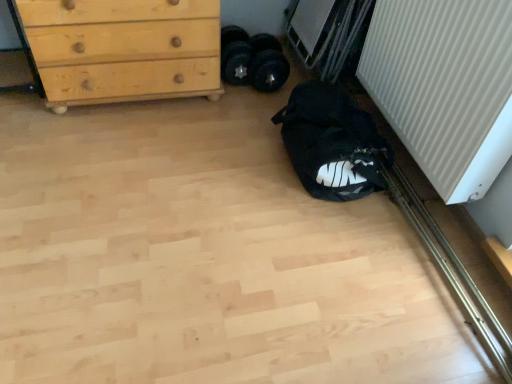
This screenshot has width=512, height=384. I want to click on free space in front of light wood/texture chest of drawers at upper left, so click(116, 156).